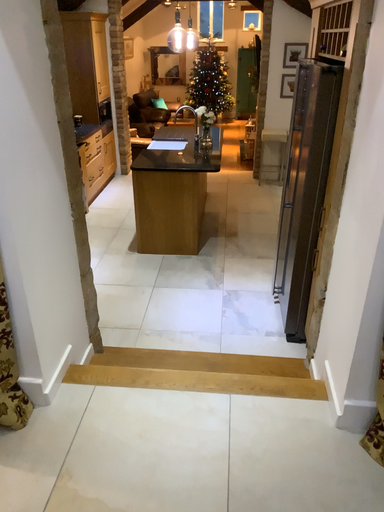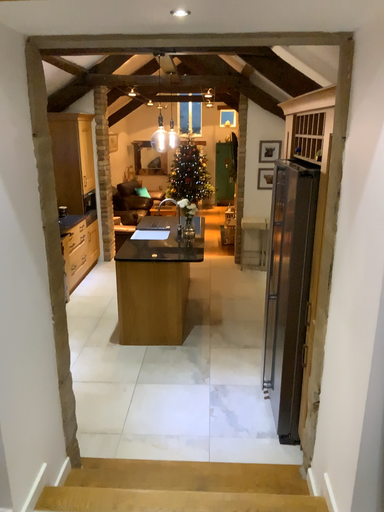
Question: Which way did the camera rotate in the video?

Choices:
 (A) rotated upward
 (B) rotated downward

Answer: (A)